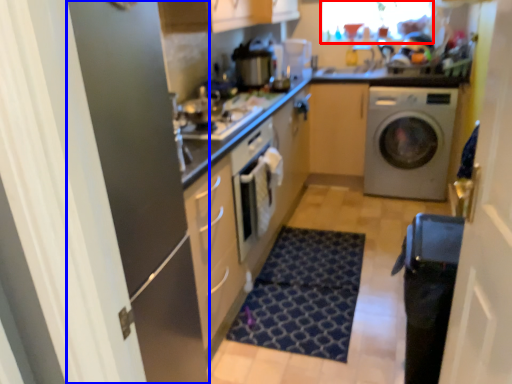
Question: Which of the following is the closest to the observer, window screen (highlighted by a red box) or screen door (highlighted by a blue box)?

Choices:
 (A) window screen
 (B) screen door

Answer: (B)